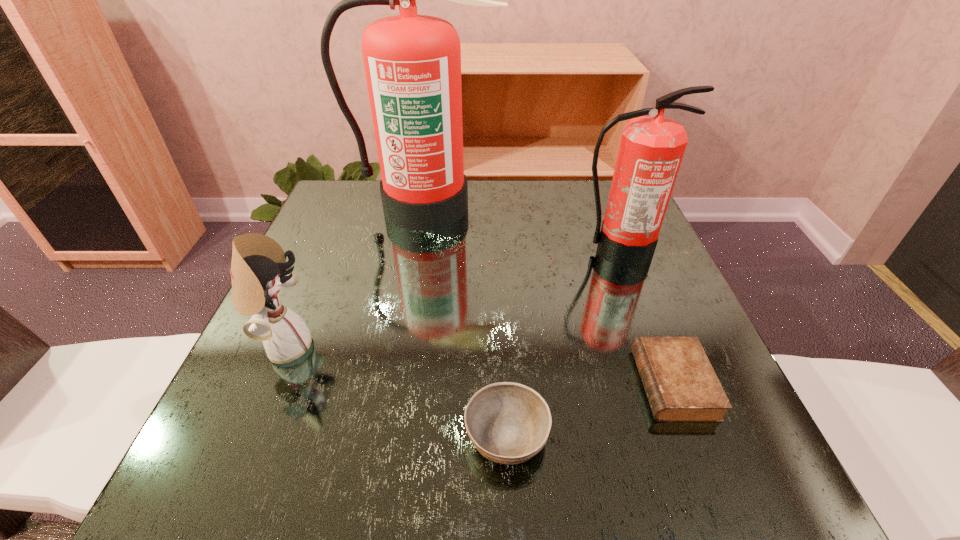
I want to click on vacant area that lies between the second shortest object and the diary, so click(x=589, y=409).

Find the location of `empty location between the doll and the fourth tallest object`. empty location between the doll and the fourth tallest object is located at coordinates click(396, 391).

Find the location of a particular element. Image resolution: width=960 pixels, height=540 pixels. vacant area that lies between the shortest object and the fourth nearest object is located at coordinates (646, 317).

Image resolution: width=960 pixels, height=540 pixels. I want to click on free space that is in between the second tallest object and the shortest object, so click(x=646, y=317).

Identify the location of free space between the diary and the left fire extinguisher. The width and height of the screenshot is (960, 540). (550, 295).

Identify the location of object that ranks as the closest to the shorter fire extinguisher. [412, 62].

Locate an element on the screen. The image size is (960, 540). object that stands as the closest to the taller fire extinguisher is located at coordinates (651, 150).

The image size is (960, 540). Find the location of `free spot that satisfies the following two spatial constraints: 1. at the front face of the doll; 2. on the back side of the fourth tallest object`. free spot that satisfies the following two spatial constraints: 1. at the front face of the doll; 2. on the back side of the fourth tallest object is located at coordinates (247, 435).

Identify the location of vacant space that satisfies the following two spatial constraints: 1. on the front side of the shorter fire extinguisher; 2. at the front face of the doll. (656, 347).

Identify the location of free space that satisfies the following two spatial constraints: 1. at the front face of the doll; 2. on the right side of the bowl. This screenshot has height=540, width=960. (247, 435).